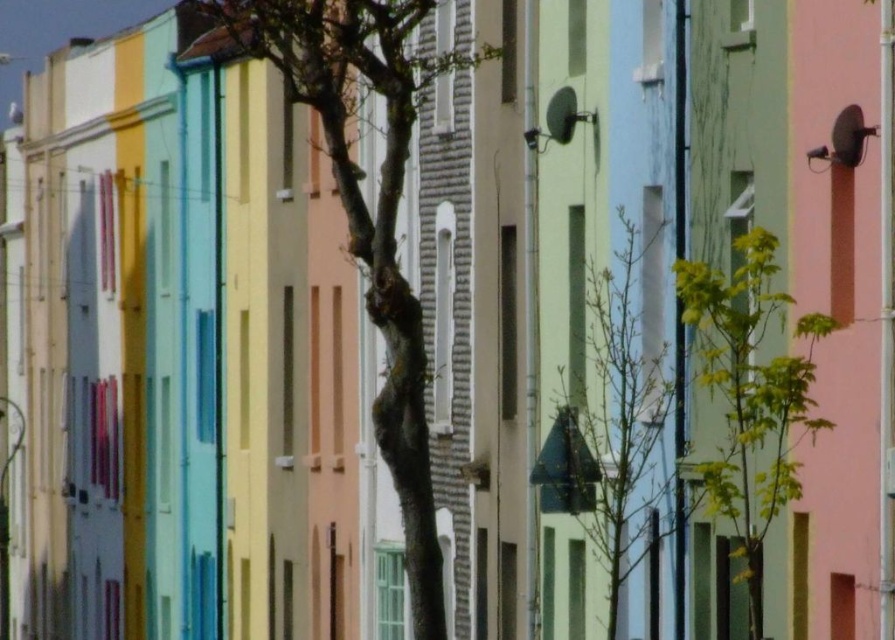
You are a gardener planning to water both the smooth bark tree at center and the green leafy tree at center. If your watering can holds enough water for 5 meters of travel, can you water both trees without refilling?

The distance between the smooth bark tree at center and the green leafy tree at center is 7.19 meters. Since the watering can allows for 5 meters of travel, you cannot water both trees without refilling as the distance exceeds the capacity.

You are a bird looking for a place to perch. You can choose between the smooth bark tree at center and the green leafy tree at right. Which tree would you choose if you want to find a higher perch?

The smooth bark tree at center is much taller than the green leafy tree at right, so you should choose the smooth bark tree at center for a higher perch.